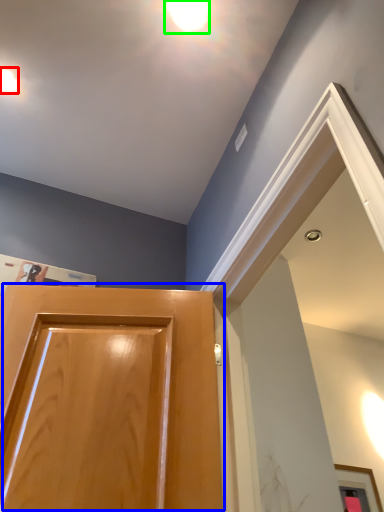
Question: Based on their relative distances, which object is farther from droplight (highlighted by a red box)? Choose from door (highlighted by a blue box) and droplight (highlighted by a green box).

Choices:
 (A) door
 (B) droplight

Answer: (A)